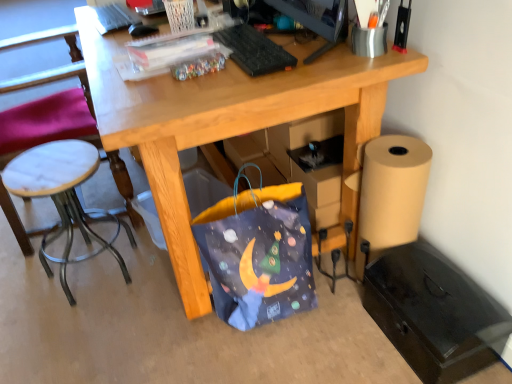
Find the location of a particular element. This screenshot has height=384, width=512. vacant space underneath white marble stool at left (from a real-world perspective) is located at coordinates (90, 274).